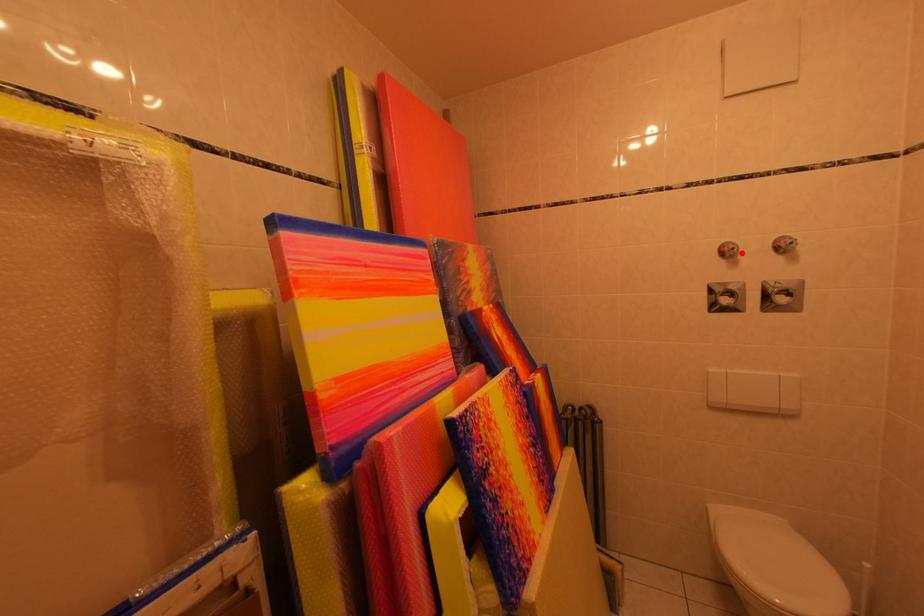
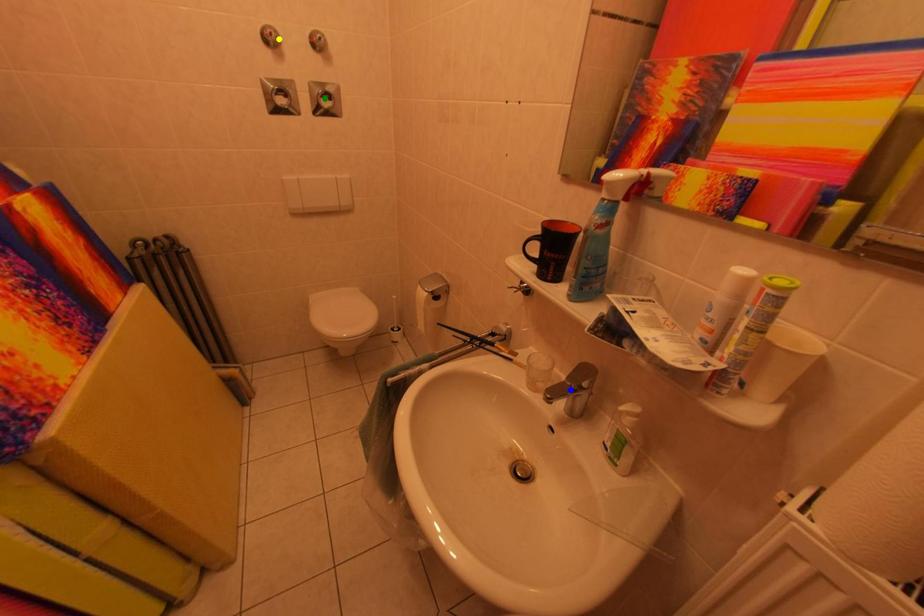
Question: I am providing you with two images of the same scene from different viewpoints. A red point is marked on the first image. You are given multiple points on the second image. Which spot in image 2 lines up with the point in image 1?

Choices:
 (A) green point
 (B) blue point
 (C) yellow point

Answer: (C)